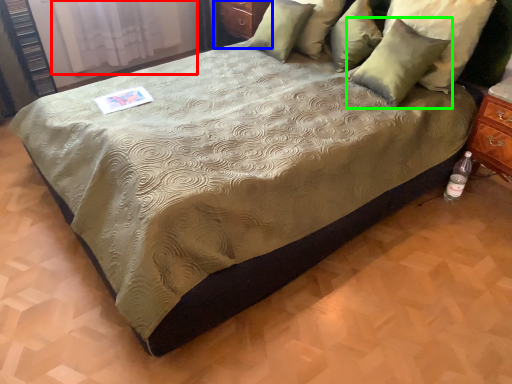
Question: Considering the real-world distances, which object is closest to curtain (highlighted by a red box)? dresser (highlighted by a blue box) or pillow (highlighted by a green box).

Choices:
 (A) dresser
 (B) pillow

Answer: (A)